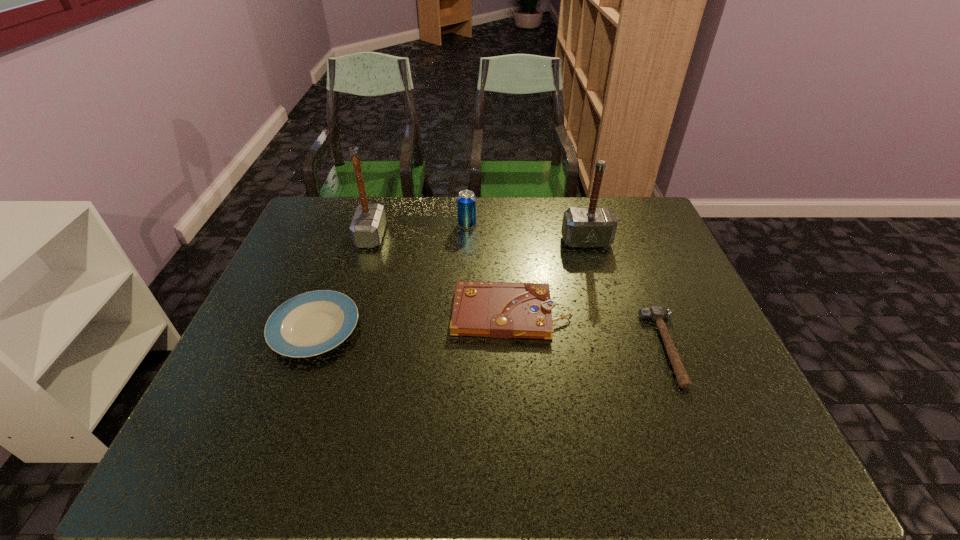
Identify the location of vacant space at the left edge of the desktop. The height and width of the screenshot is (540, 960). (326, 273).

Image resolution: width=960 pixels, height=540 pixels. In the image, there is a desktop. Identify the location of vacant region at the right edge. (702, 366).

In the image, there is a desktop. In order to click on vacant space at the far left corner in this screenshot , I will do pos(346,213).

The image size is (960, 540). I want to click on free space at the far right corner of the desktop, so click(x=625, y=217).

Locate an element on the screen. free region at the near right corner is located at coordinates (719, 458).

Find the location of `free spot between the second hammer from left to right and the rightmost hammer`. free spot between the second hammer from left to right and the rightmost hammer is located at coordinates (626, 295).

What are the coordinates of `vacant point located between the leftmost hammer and the notebook` in the screenshot? It's located at tap(441, 275).

You are a GUI agent. You are given a task and a screenshot of the screen. Output one action in this format:
    pyautogui.click(x=<x>, y=<y>)
    Task: Click on the vacant area between the third shortest object and the beer can
    This screenshot has width=960, height=540.
    Given the screenshot: What is the action you would take?
    pyautogui.click(x=489, y=268)

At what (x,y) coordinates should I click in order to perform the action: click on blank region between the fifth object from left to right and the third tallest object. Please return your answer as a coordinate pair (x, y). Looking at the image, I should click on (526, 233).

Where is `empty space that is in between the rightmost hammer and the fifth object from left to right`? Image resolution: width=960 pixels, height=540 pixels. empty space that is in between the rightmost hammer and the fifth object from left to right is located at coordinates pos(626,295).